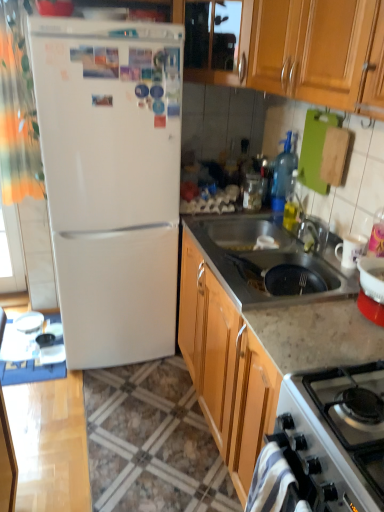
The width and height of the screenshot is (384, 512). What are the coordinates of `vacant space situated above marble countertop at lower right (from a real-world perspective)` in the screenshot? It's located at (152, 411).